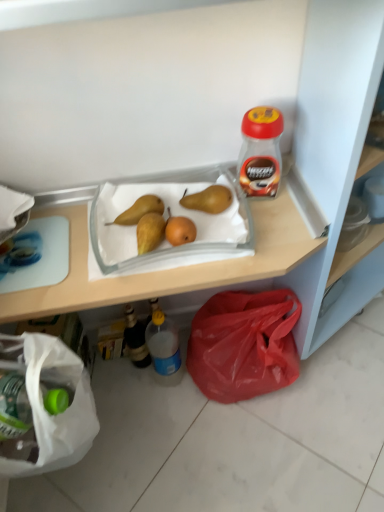
Where is `free space in front of red plastic bag at lower right`? Image resolution: width=384 pixels, height=512 pixels. free space in front of red plastic bag at lower right is located at coordinates (259, 449).